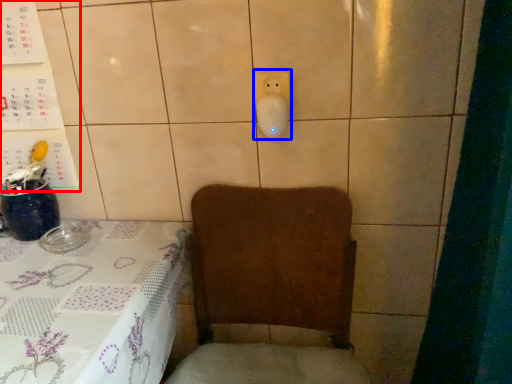
Question: Which point is further to the camera, bulletin board (highlighted by a red box) or electric outlet (highlighted by a blue box)?

Choices:
 (A) bulletin board
 (B) electric outlet

Answer: (A)